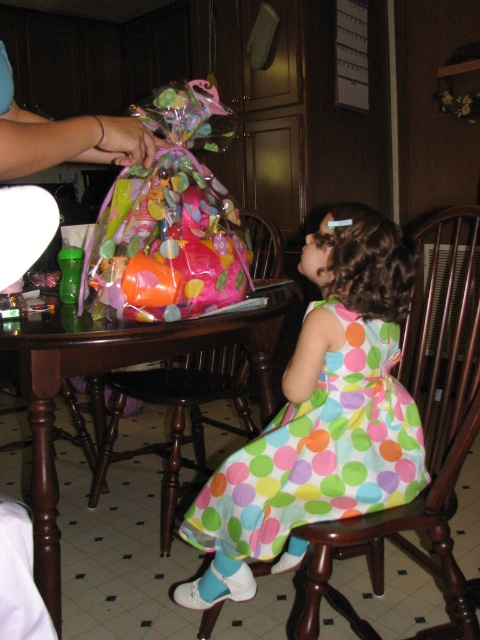
Question: Which point is farther to the camera?

Choices:
 (A) multicolored polka dot dress at lower center
 (B) dark wood table at center
 (C) wooden chair at right
 (D) wooden chair at left

Answer: (D)

Question: Is wooden chair at right wider than wooden chair at left?

Choices:
 (A) yes
 (B) no

Answer: (A)

Question: Which point appears closest to the camera in this image?

Choices:
 (A) (264, 317)
 (B) (421, 516)

Answer: (B)

Question: Is multicolored polka dot dress at lower center to the left of dark wood table at center from the viewer's perspective?

Choices:
 (A) no
 (B) yes

Answer: (A)

Question: Does wooden chair at right have a smaller size compared to dark wood table at center?

Choices:
 (A) yes
 (B) no

Answer: (B)

Question: Estimate the real-world distances between objects in this image. Which object is farther from the wooden chair at left?

Choices:
 (A) wooden chair at right
 (B) multicolored polka dot dress at lower center

Answer: (A)